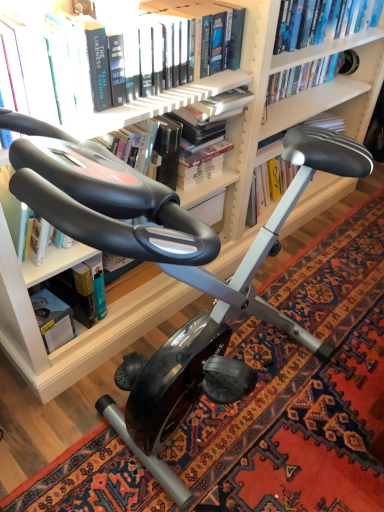
Question: In which direction should I rotate to look at hardcover book at upper center, the 1th book from the front?

Choices:
 (A) left
 (B) right

Answer: (A)

Question: Is hardcover book at left, which is counted as the third book, starting from the front, smaller than hardcover book at lower left?

Choices:
 (A) yes
 (B) no

Answer: (B)

Question: From a real-world perspective, is hardcover book at left, which is counted as the third book, starting from the front, located higher than hardcover book at lower left?

Choices:
 (A) yes
 (B) no

Answer: (A)

Question: Is hardcover book at lower left completely or partially inside hardcover book at left, which is counted as the third book, starting from the front?

Choices:
 (A) yes
 (B) no

Answer: (B)

Question: Is the position of hardcover book at left, the 2th book positioned from the back, more distant than that of hardcover book at lower left?

Choices:
 (A) yes
 (B) no

Answer: (A)

Question: Can you confirm if hardcover book at left, which is counted as the third book, starting from the front, is taller than hardcover book at lower left?

Choices:
 (A) yes
 (B) no

Answer: (A)

Question: Is hardcover book at left, which is counted as the third book, starting from the front, facing towards hardcover book at lower left?

Choices:
 (A) no
 (B) yes

Answer: (A)

Question: Is hardcover book at upper center, the 1th book from the back, touching black rubber exercise bike at center?

Choices:
 (A) no
 (B) yes

Answer: (A)

Question: Considering the relative positions of hardcover book at upper center, which appears as the 4th book when viewed from the front, and black rubber exercise bike at center in the image provided, is hardcover book at upper center, which appears as the 4th book when viewed from the front, to the left of black rubber exercise bike at center from the viewer's perspective?

Choices:
 (A) no
 (B) yes

Answer: (A)

Question: From the image's perspective, is hardcover book at upper center, the 1th book from the back, located above black rubber exercise bike at center?

Choices:
 (A) yes
 (B) no

Answer: (A)

Question: Does hardcover book at upper center, the 1th book from the back, have a greater height compared to black rubber exercise bike at center?

Choices:
 (A) yes
 (B) no

Answer: (A)

Question: From a real-world perspective, is hardcover book at upper center, which appears as the 4th book when viewed from the front, on black rubber exercise bike at center?

Choices:
 (A) yes
 (B) no

Answer: (A)

Question: Is black rubber exercise bike at center at the back of hardcover book at upper center, the 1th book from the back?

Choices:
 (A) yes
 (B) no

Answer: (B)

Question: Is hardcover book at left, the 2th book positioned from the back, aimed at hardcover book at upper center, the 1th book from the back?

Choices:
 (A) no
 (B) yes

Answer: (A)